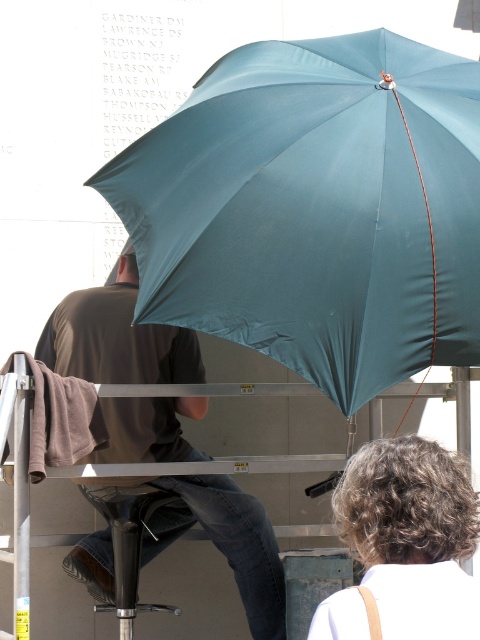
You are standing in the scene and want to locate the matte black shirt at center. According to the coordinates given, where would you look relative to the center of the image?

The matte black shirt at center is located at coordinates approximately 0.527 on the x axis and 0.244 on the y axis, which is slightly to the right and below the center point of the image.

You are a photographer trying to capture a candid shot of the matte black shirt at center and the black plastic stool at lower center. You need to ensure both subjects are fully visible in the frame. Given their sizes, which subject might require you to adjust your camera angle to avoid cropping?

The matte black shirt at center is wider than the black plastic stool at lower center, so you might need to adjust your camera angle to ensure the entire width of the matte black shirt at center fits in the frame without cropping.